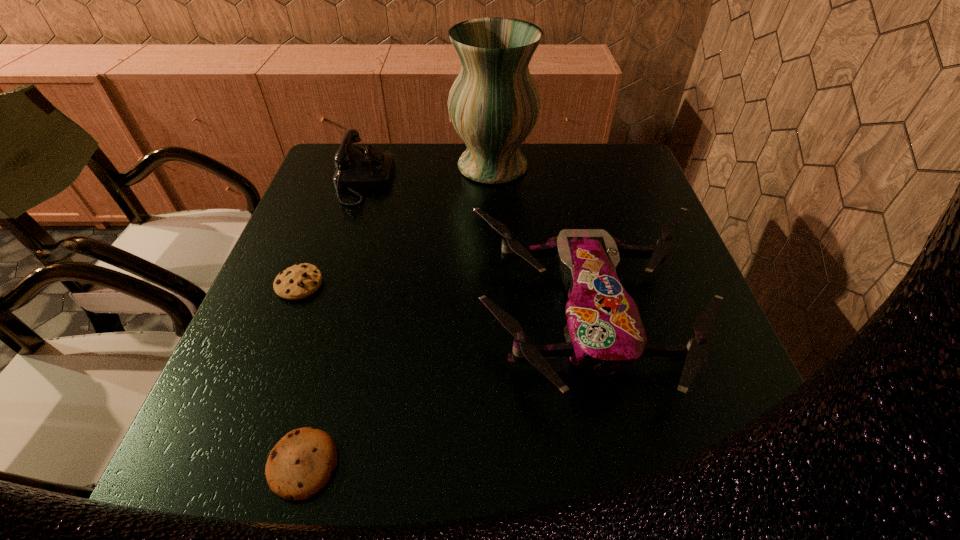
At what (x,y) coordinates should I click in order to perform the action: click on free point between the farther cookie and the right cookie. Please return your answer as a coordinate pair (x, y). The width and height of the screenshot is (960, 540). Looking at the image, I should click on (301, 374).

This screenshot has width=960, height=540. I want to click on free point between the vase and the nearest object, so click(x=398, y=315).

Locate an element on the screen. blank region between the vase and the drone is located at coordinates (541, 241).

Where is `the second closest object relative to the left cookie`? The height and width of the screenshot is (540, 960). the second closest object relative to the left cookie is located at coordinates (301, 463).

I want to click on object that can be found as the second closest to the vase, so click(604, 334).

Locate an element on the screen. blank area in the image that satisfies the following two spatial constraints: 1. on the back side of the farther cookie; 2. on the right side of the tallest object is located at coordinates (346, 166).

Where is `free space in the image that satisfies the following two spatial constraints: 1. on the dial of the telephone; 2. on the back side of the nearer cookie`? free space in the image that satisfies the following two spatial constraints: 1. on the dial of the telephone; 2. on the back side of the nearer cookie is located at coordinates (273, 464).

Find the location of a particular element. The width and height of the screenshot is (960, 540). free point that satisfies the following two spatial constraints: 1. on the dial of the right cookie; 2. on the right side of the telephone is located at coordinates (273, 464).

Locate an element on the screen. blank area in the image that satisfies the following two spatial constraints: 1. on the front side of the right cookie; 2. on the left side of the left cookie is located at coordinates (229, 464).